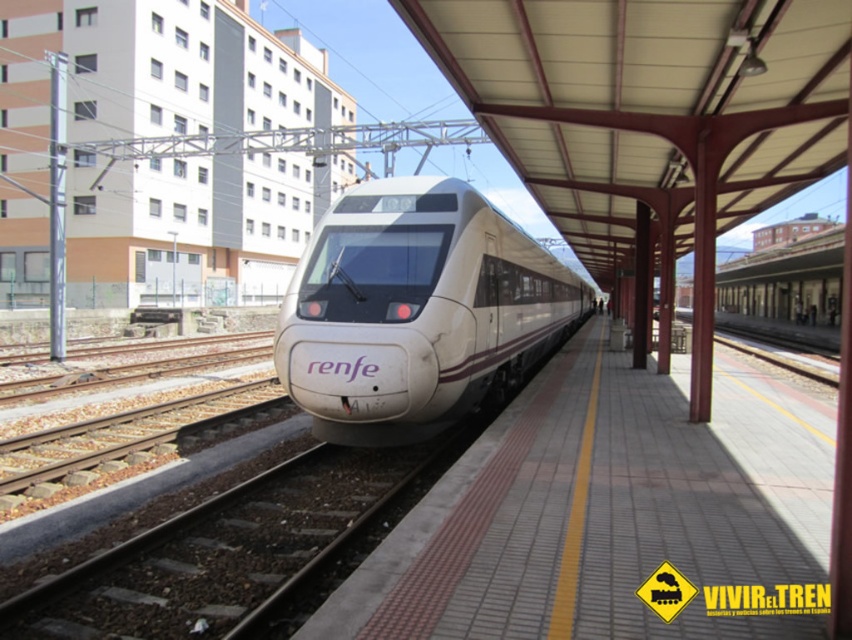
You are a passenger waiting on the white tile platform at center. You look up and see the white glossy bullet train at center. Is the train above or below you?

The white tile platform at center is below the white glossy bullet train at center, so the train is above you.

You are a passenger waiting on the white tile platform at center. You want to board the white glossy bullet train at center. Which direction should you walk to reach the train?

The white tile platform at center is in front of the white glossy bullet train at center, so you should walk forward towards the train to board it.